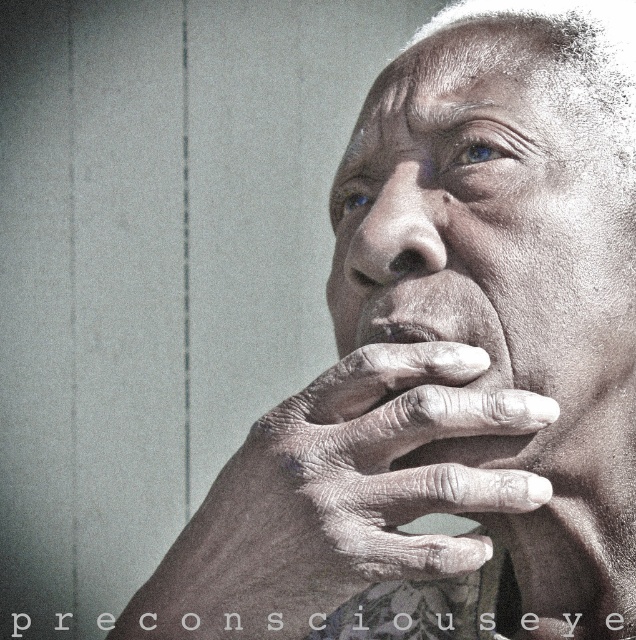
What do you see at coordinates (389, 228) in the screenshot? This screenshot has width=636, height=640. I see `smooth skin nose at center` at bounding box center [389, 228].

Does point (377, 257) come farther from viewer compared to point (371, 321)?

No, (377, 257) is in front of (371, 321).

Where is `smooth skin nose at center`? The height and width of the screenshot is (640, 636). smooth skin nose at center is located at coordinates (389, 228).

Between smooth skin face at center and smooth skin nose at center, which one is positioned lower?

Positioned lower is smooth skin face at center.

Who is shorter, smooth skin face at center or smooth skin nose at center?

With less height is smooth skin nose at center.

The width and height of the screenshot is (636, 640). What do you see at coordinates (499, 236) in the screenshot?
I see `smooth skin face at center` at bounding box center [499, 236].

Find the location of `smooth skin face at center`. smooth skin face at center is located at coordinates (499, 236).

Is smooth skin face at center in front of gray textured hand at center?

That is False.

Which is in front, point (459, 316) or point (536, 403)?

Point (536, 403) is more forward.

Is point (356, 228) farther from camera compared to point (436, 364)?

Yes.

Where is `smooth skin face at center`? This screenshot has height=640, width=636. smooth skin face at center is located at coordinates [499, 236].